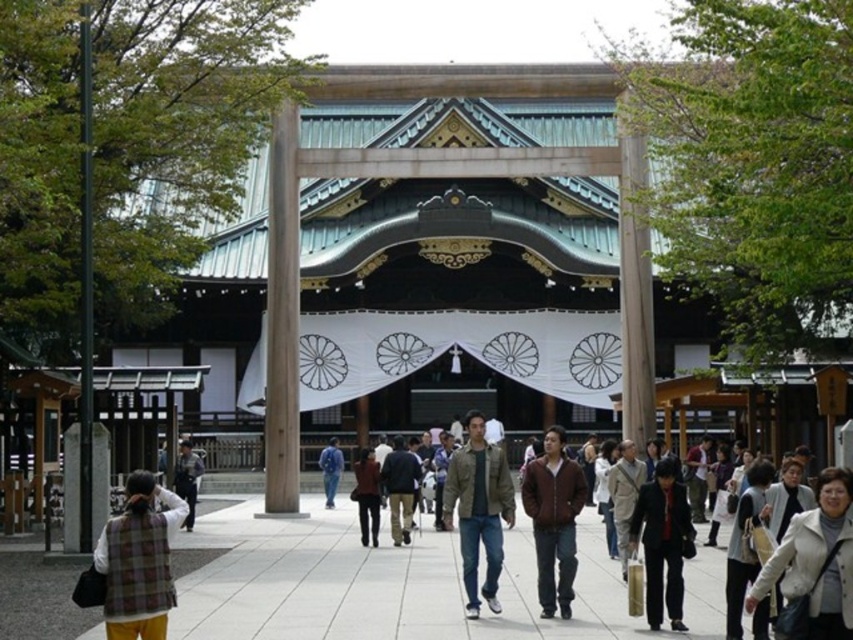
Question: Which point is farther to the camera?

Choices:
 (A) (804, 547)
 (B) (763, 634)
 (C) (374, 484)

Answer: (C)

Question: Considering the real-world distances, which object is closest to the white leather jacket at lower right?

Choices:
 (A) dark brown leather jacket at lower right
 (B) dark brown leather jacket at center
 (C) dark red fabric bag at lower right
 (D) plaid fabric vest at lower left

Answer: (A)

Question: Observing the image, what is the correct spatial positioning of white leather jacket at lower right in reference to brown leather jacket at center?

Choices:
 (A) above
 (B) below

Answer: (A)

Question: Can you confirm if white leather jacket at lower right is positioned to the right of dark brown leather jacket at lower right?

Choices:
 (A) yes
 (B) no

Answer: (A)

Question: Does dark red fabric bag at lower right appear under dark brown leather jacket at center?

Choices:
 (A) yes
 (B) no

Answer: (A)

Question: Which point is closer to the camera taking this photo?

Choices:
 (A) (676, 465)
 (B) (555, 444)
 (C) (364, 502)

Answer: (A)